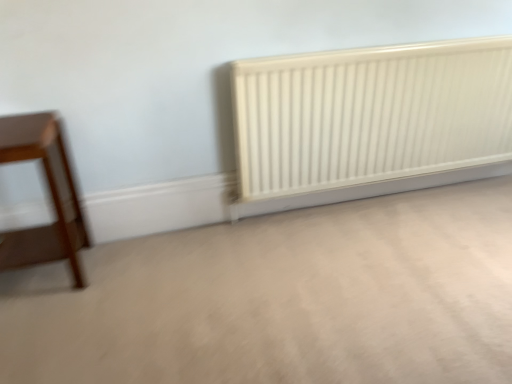
Measure the distance between point (25, 143) and camera.

The depth of point (25, 143) is 4.90 feet.

This screenshot has height=384, width=512. In order to click on brown wooden chair at left in this screenshot , I will do `click(50, 193)`.

This screenshot has height=384, width=512. What do you see at coordinates (50, 193) in the screenshot?
I see `brown wooden chair at left` at bounding box center [50, 193].

In order to face brown wooden chair at left, should I rotate leftwards or rightwards?

Turn left approximately 29.127 degrees to face it.

The height and width of the screenshot is (384, 512). In order to click on brown wooden chair at left in this screenshot , I will do `click(50, 193)`.